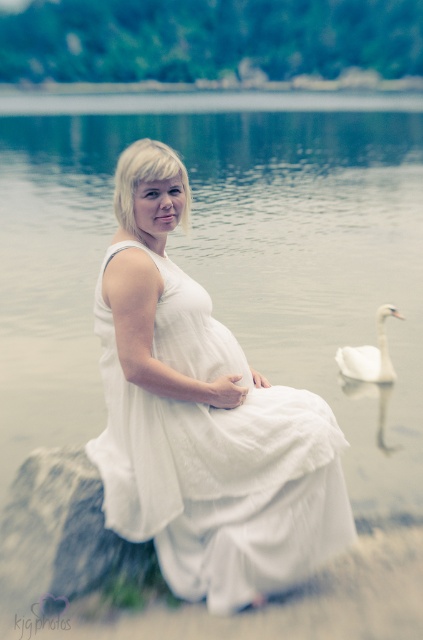
You are an artist trying to sketch this scene. You notice the white linen dress at center and the white smooth swan at lower right. Which object should you draw first if you want to follow the rule of drawing larger objects before smaller ones?

The white linen dress at center is larger in size than the white smooth swan at lower right, so you should draw the white linen dress at center first.

In the serene outdoor scene, you notice the clear water at center and the white linen dress at center. Which object occupies a larger area in the image?

The clear water at center is bigger than the white linen dress at center, so the clear water at center occupies a larger area in the image.

You are a photographer trying to capture the white linen dress at center and the white smooth swan at lower right in the same frame. Based on their sizes in the image, which object would appear larger in your photo?

The white linen dress at center appears larger in the photo because it is taller than the white smooth swan at lower right.